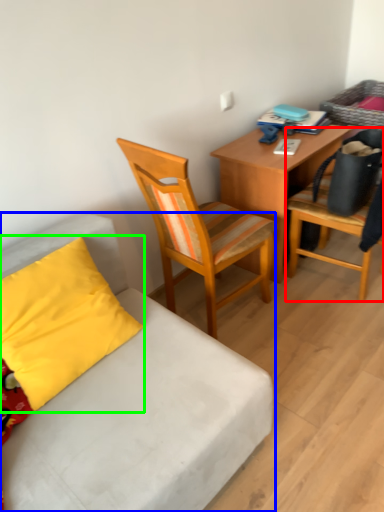
Question: Considering the real-world distances, which object is farthest from chair (highlighted by a red box)? studio couch (highlighted by a blue box) or pillow (highlighted by a green box)?

Choices:
 (A) studio couch
 (B) pillow

Answer: (B)